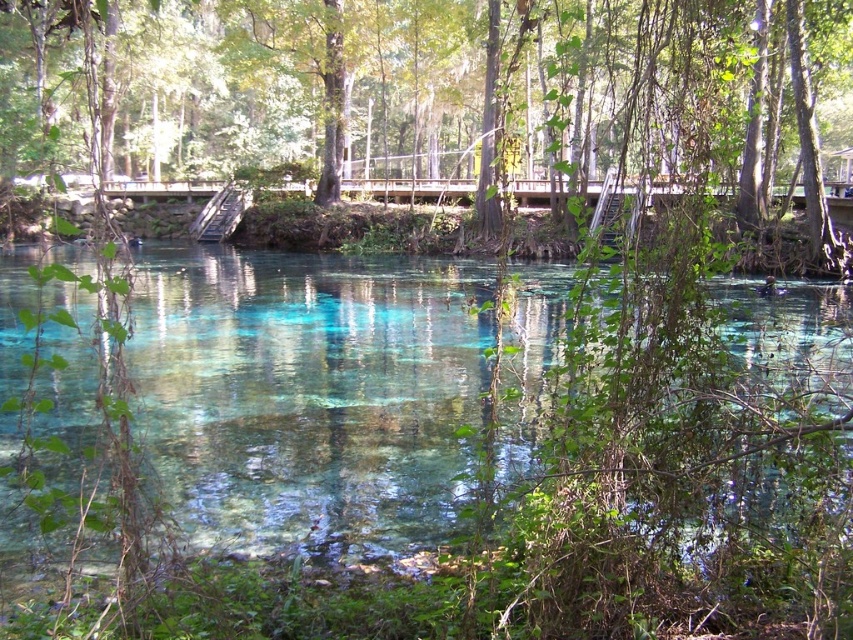
Does green leafy tree at center have a greater width compared to clear glassy water at center?

Yes.

How far apart are green leafy tree at center and clear glassy water at center?

The distance of green leafy tree at center from clear glassy water at center is 7.45 meters.

I want to click on green leafy tree at center, so click(x=431, y=99).